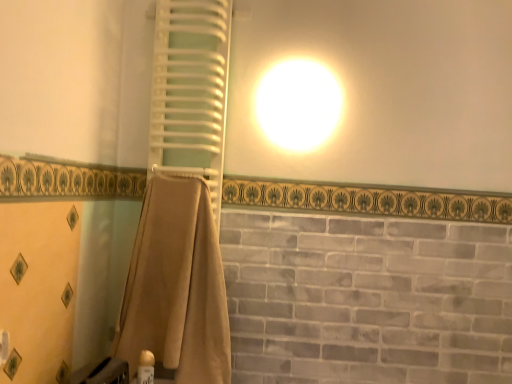
Question: Is white plastic towel rack at upper left at the right side of gold plastic can at lower left?

Choices:
 (A) yes
 (B) no

Answer: (A)

Question: Is white plastic towel rack at upper left directly adjacent to gold plastic can at lower left?

Choices:
 (A) no
 (B) yes

Answer: (A)

Question: From a real-world perspective, is white plastic towel rack at upper left on gold plastic can at lower left?

Choices:
 (A) no
 (B) yes

Answer: (B)

Question: Can you confirm if white plastic towel rack at upper left is shorter than gold plastic can at lower left?

Choices:
 (A) no
 (B) yes

Answer: (A)

Question: Is white plastic towel rack at upper left wider than gold plastic can at lower left?

Choices:
 (A) yes
 (B) no

Answer: (A)

Question: From a real-world perspective, is gold plastic can at lower left above or below beige fabric towel at center?

Choices:
 (A) above
 (B) below

Answer: (B)

Question: Based on their positions, is gold plastic can at lower left located to the left or right of beige fabric towel at center?

Choices:
 (A) left
 (B) right

Answer: (A)

Question: Considering the positions of point (140, 357) and point (157, 312), is point (140, 357) closer or farther from the camera than point (157, 312)?

Choices:
 (A) closer
 (B) farther

Answer: (A)

Question: Considering the positions of gold plastic can at lower left and beige fabric towel at center in the image, is gold plastic can at lower left wider or thinner than beige fabric towel at center?

Choices:
 (A) wide
 (B) thin

Answer: (B)

Question: Considering the positions of white plastic towel rack at upper left and beige fabric towel at center in the image, is white plastic towel rack at upper left taller or shorter than beige fabric towel at center?

Choices:
 (A) short
 (B) tall

Answer: (B)

Question: Looking at their shapes, would you say white plastic towel rack at upper left is wider or thinner than beige fabric towel at center?

Choices:
 (A) thin
 (B) wide

Answer: (A)

Question: From the image's perspective, is white plastic towel rack at upper left positioned above or below beige fabric towel at center?

Choices:
 (A) below
 (B) above

Answer: (B)

Question: Is white plastic towel rack at upper left situated inside beige fabric towel at center or outside?

Choices:
 (A) inside
 (B) outside

Answer: (B)

Question: Is white plastic towel rack at upper left bigger or smaller than gold plastic can at lower left?

Choices:
 (A) small
 (B) big

Answer: (B)

Question: Considering their positions, is white plastic towel rack at upper left located in front of or behind gold plastic can at lower left?

Choices:
 (A) behind
 (B) front

Answer: (A)